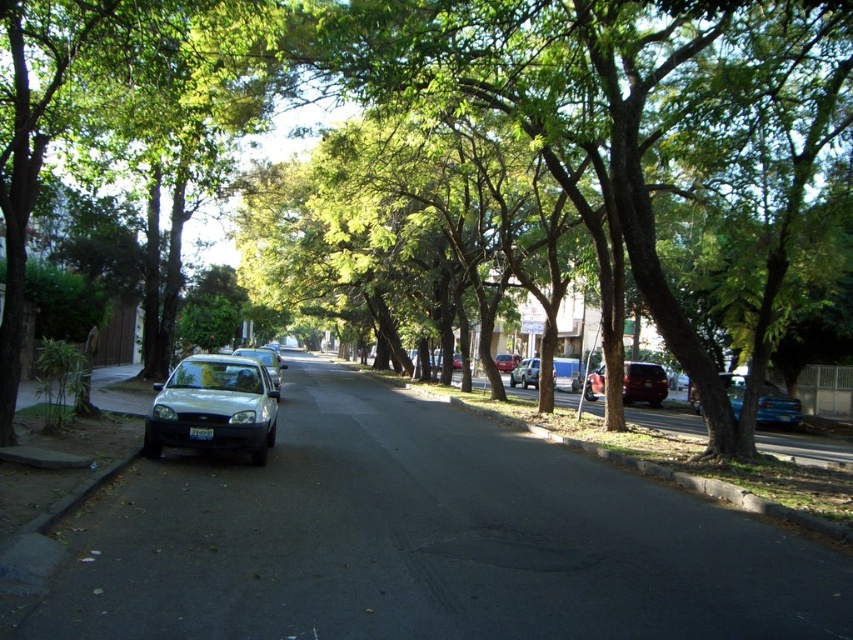
Question: Which object is positioned farthest from the satin silver sedan at left?

Choices:
 (A) metallic red car at center
 (B) shiny red suv at right
 (C) satin silver sedan at center

Answer: (A)

Question: In this image, where is shiny red suv at right located relative to satin silver sedan at center?

Choices:
 (A) left
 (B) right

Answer: (B)

Question: Which object appears closest to the camera in this image?

Choices:
 (A) satin silver suv at center
 (B) metallic blue sedan at center
 (C) shiny red suv at right

Answer: (B)

Question: Does green leafy tree at center lie in front of metallic red car at center?

Choices:
 (A) yes
 (B) no

Answer: (A)

Question: Which object appears closest to the camera in this image?

Choices:
 (A) satin silver sedan at left
 (B) metallic blue sedan at center
 (C) green leafy tree at center
 (D) satin silver sedan at center

Answer: (C)

Question: Considering the relative positions of green leafy tree at center and satin silver sedan at center in the image provided, where is green leafy tree at center located with respect to satin silver sedan at center?

Choices:
 (A) below
 (B) above

Answer: (B)